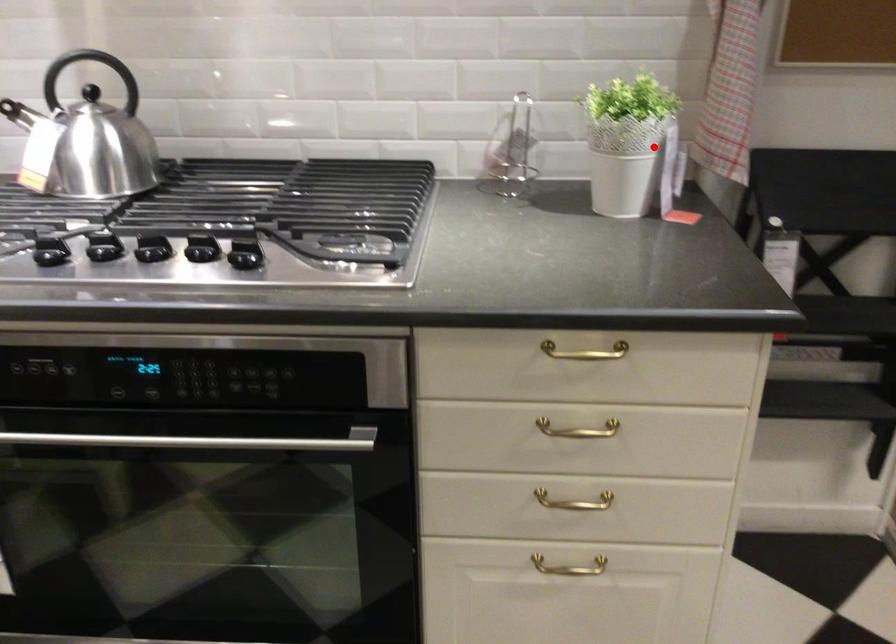
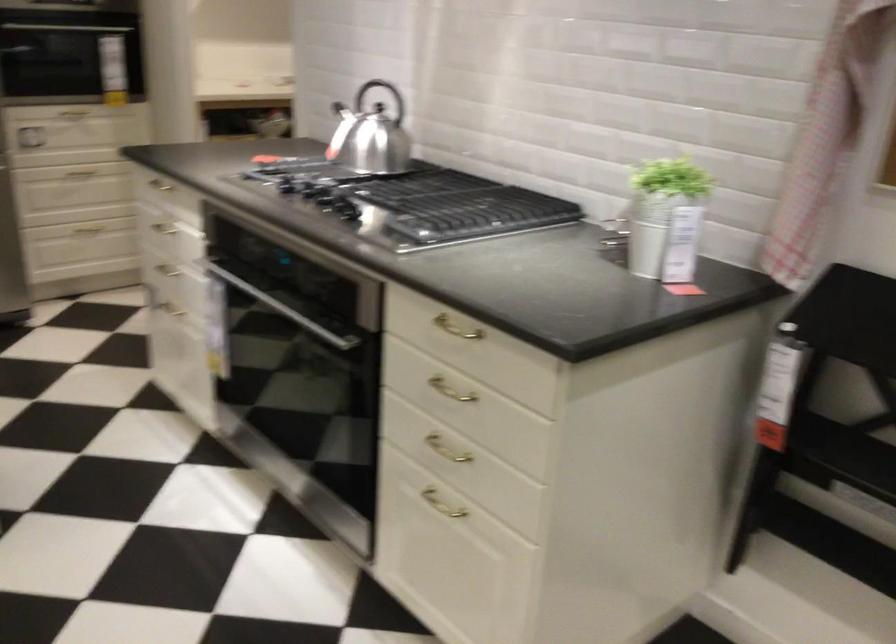
Locate, in the second image, the point that corresponds to the highlighted location in the first image.

(666, 219)